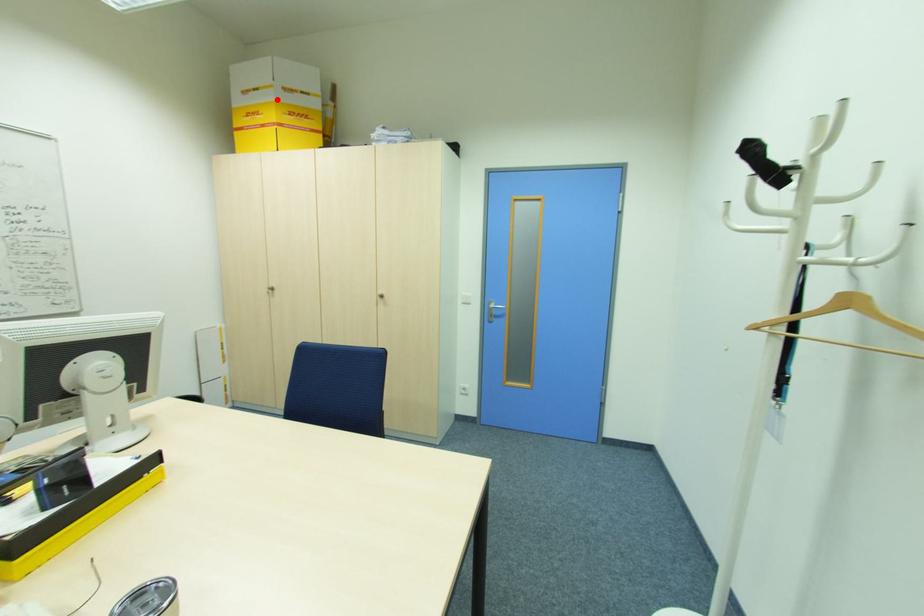
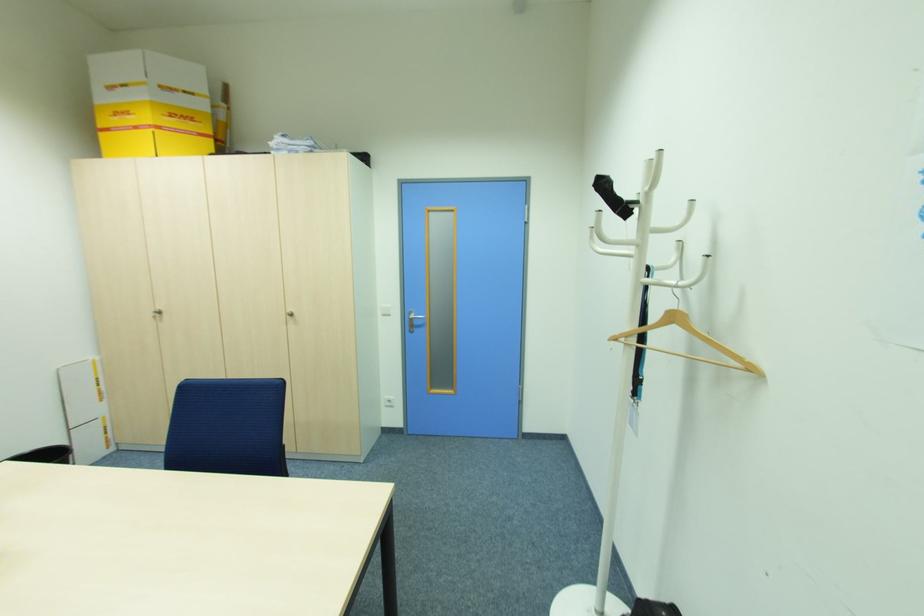
Locate, in the second image, the point that corresponds to the highlighted location in the first image.

(147, 95)